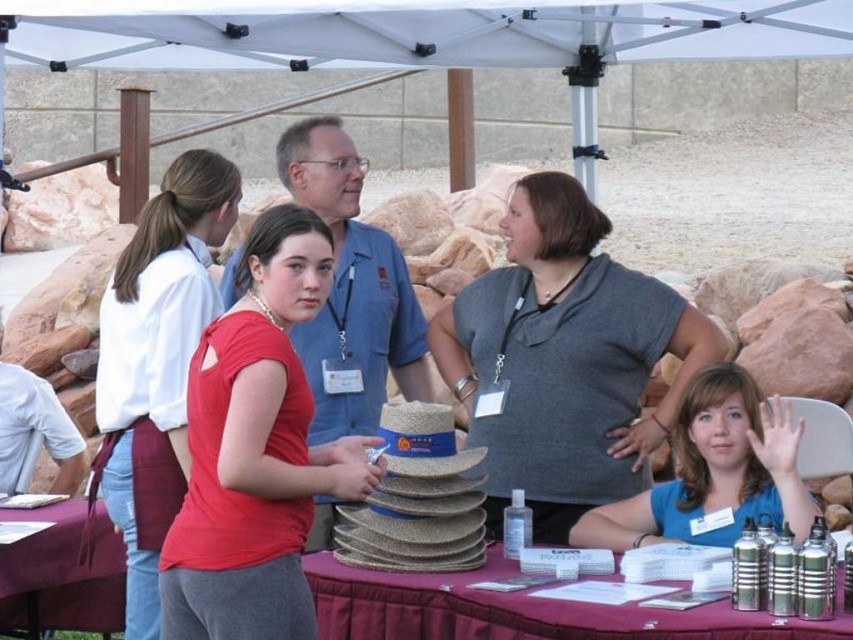
Question: Can you confirm if gray matte shirt at center is wider than maroon fabric table at lower left?

Choices:
 (A) no
 (B) yes

Answer: (B)

Question: Which of the following is the farthest from the observer?

Choices:
 (A) (577, 380)
 (B) (67, 576)
 (C) (90, 545)
 (D) (726, 620)

Answer: (A)

Question: Is gray matte shirt at center wider than blue fabric shirt at center?

Choices:
 (A) no
 (B) yes

Answer: (B)

Question: From the image, what is the correct spatial relationship of gray matte shirt at center in relation to metallic silver water bottles at lower right?

Choices:
 (A) below
 (B) above

Answer: (B)

Question: Which of the following is the farthest from the observer?

Choices:
 (A) (57, 540)
 (B) (480, 324)
 (C) (665, 618)

Answer: (B)

Question: Which point is closer to the camera?

Choices:
 (A) metallic silver water bottles at lower right
 (B) maroon fabric table at lower left
 (C) gray matte shirt at center

Answer: (A)